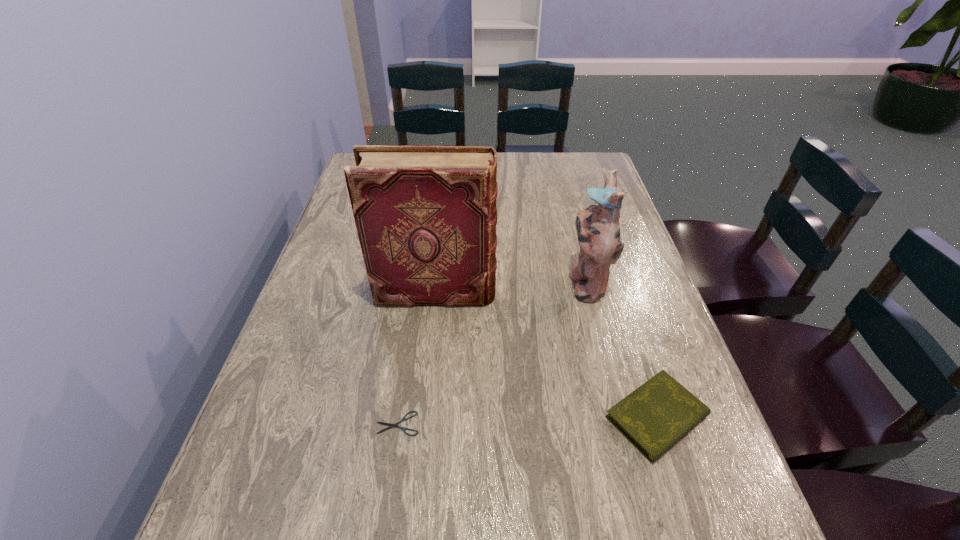
Find the location of a particular element. This screenshot has height=540, width=960. figurine that is at the right edge is located at coordinates (597, 226).

At what (x,y) coordinates should I click in order to perform the action: click on diary that is at the right edge. Please return your answer as a coordinate pair (x, y). Looking at the image, I should click on (654, 417).

The height and width of the screenshot is (540, 960). Identify the location of free location at the far edge. click(534, 178).

This screenshot has height=540, width=960. I want to click on vacant space at the left edge of the desktop, so click(x=358, y=338).

Where is `vacant region at the right edge of the desktop`? This screenshot has height=540, width=960. vacant region at the right edge of the desktop is located at coordinates (646, 349).

Where is `free space at the far right corner of the desktop`? The image size is (960, 540). free space at the far right corner of the desktop is located at coordinates (583, 155).

This screenshot has width=960, height=540. I want to click on unoccupied area between the second tallest object and the shears, so click(492, 353).

The height and width of the screenshot is (540, 960). I want to click on vacant point located between the diary and the shears, so click(x=527, y=420).

At what (x,y) coordinates should I click in order to perform the action: click on free spot between the diary and the figurine. Please return your answer as a coordinate pair (x, y). The image size is (960, 540). Looking at the image, I should click on (621, 350).

This screenshot has width=960, height=540. I want to click on unoccupied area between the shears and the hardback book, so click(418, 358).